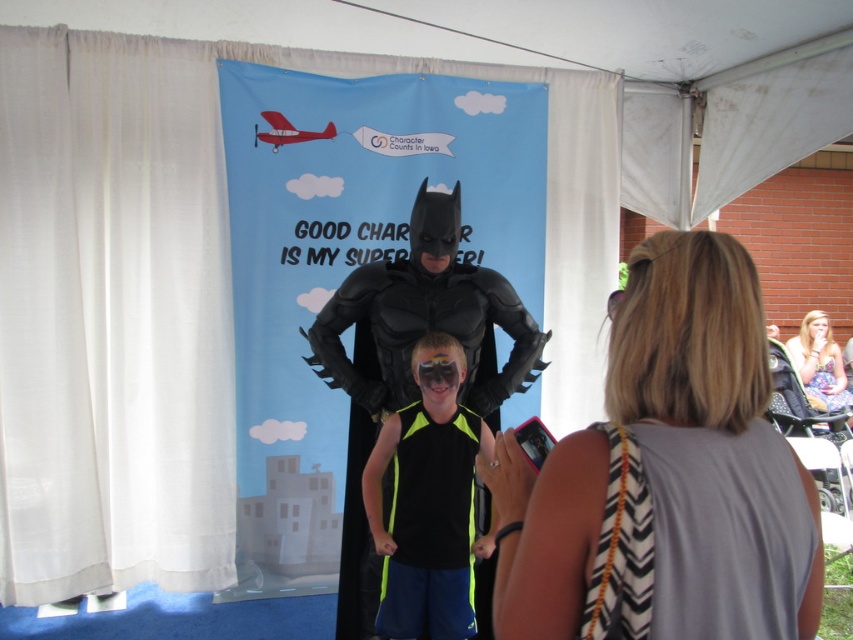
You are organizing a costume party and need to decide which outfit to choose between the gray fabric tank top at center and the gray fabric dress at lower right. Based on their sizes, which one would you pick if you want something more spacious?

The gray fabric tank top at center is bigger than the gray fabric dress at lower right, so you should choose the gray fabric tank top at center for a more spacious fit.

You are at the event and want to take a photo of the black matte costume at center. Where should you position yourself to capture it in the frame?

The black matte costume at center is located at coordinates point (408, 362), so you should position yourself facing the center of the tent to capture it in the frame.